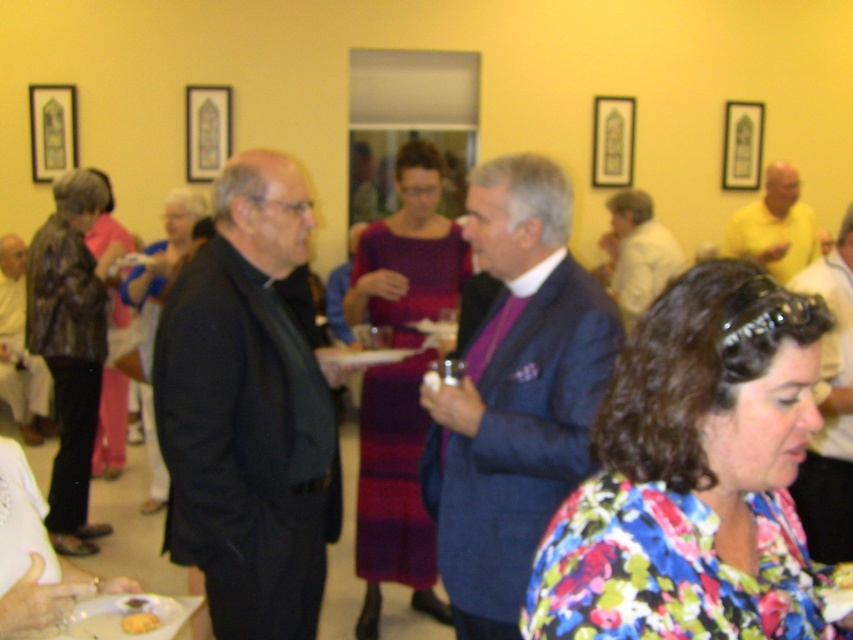
You are organizing a photo shoot and need to place two models wearing the black leather suit at center and the blue wool suit at center side by side. Based on the scene description, which model should stand on the left to ensure both fit within a 2.5 meter wide frame?

The black leather suit at center has a lesser width compared to the blue wool suit at center. To fit both within the 2.5 meter frame, place the narrower black leather suit at center on the left and the wider blue wool suit at center on the right, ensuring adequate spacing between them.

You are at the event and need to determine which item takes up more space between the leather jacket at left and the pink fabric dress at left. Which one is bigger?

The leather jacket at left is larger in size than the pink fabric dress at left, so the leather jacket at left takes up more space.

You are standing in the room and want to find the black leather suit at center. Can you tell me where exactly the point at coordinate (x=247, y=410) is located?

The point at coordinate (x=247, y=410) is located on the black leather suit at center.